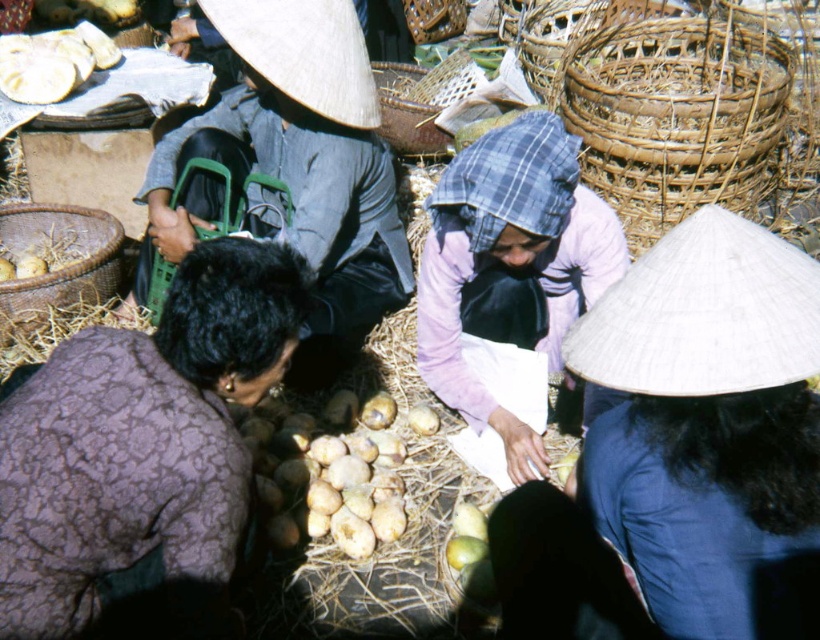
Question: Which of these objects is positioned farthest from the purple textured fabric at lower left?

Choices:
 (A) brown woven basket at lower left
 (B) white straw hat at lower right
 (C) smooth brown potatoes at center

Answer: (A)

Question: Observing the image, what is the correct spatial positioning of light purple fabric at center in reference to smooth brown potatoes at center?

Choices:
 (A) left
 (B) right

Answer: (B)

Question: Which of the following is the farthest from the observer?

Choices:
 (A) brown woven basket at lower left
 (B) white straw hat at lower right
 (C) brown woven basket at upper right

Answer: (C)

Question: Does woven bamboo basket at upper right have a lesser width compared to woven straw basket at upper center?

Choices:
 (A) yes
 (B) no

Answer: (B)

Question: Among these points, which one is nearest to the camera?

Choices:
 (A) (620, 364)
 (B) (768, 116)
 (C) (336, 509)
 (D) (137, 509)

Answer: (A)

Question: Can you confirm if white straw hat at lower right is positioned below woven bamboo basket at upper center?

Choices:
 (A) yes
 (B) no

Answer: (A)